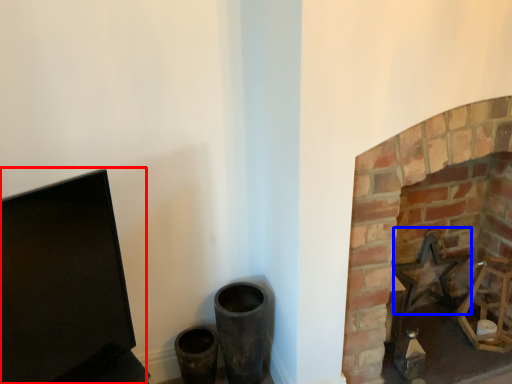
Question: Which object is further to the camera taking this photo, computer monitor (highlighted by a red box) or swivel chair (highlighted by a blue box)?

Choices:
 (A) computer monitor
 (B) swivel chair

Answer: (B)